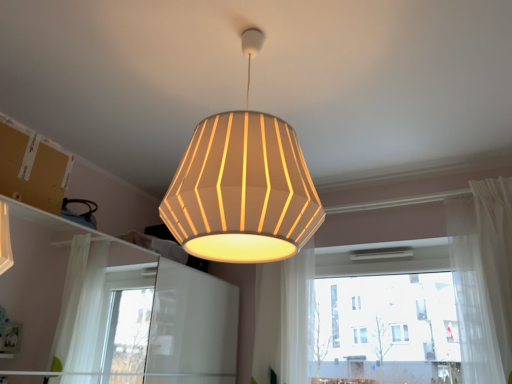
Where is `brown cardboard at upper left`? brown cardboard at upper left is located at coordinates (33, 167).

Locate an element on the screen. The width and height of the screenshot is (512, 384). white sheer curtain at right, which is the first curtain in right-to-left order is located at coordinates (483, 278).

From a real-world perspective, which is physically below, matte white lampshade at center or brown cardboard at upper left?

brown cardboard at upper left.

Which of these two, matte white lampshade at center or brown cardboard at upper left, stands taller?

Standing taller between the two is matte white lampshade at center.

Choose the correct answer: Is matte white lampshade at center inside brown cardboard at upper left or outside it?

matte white lampshade at center cannot be found inside brown cardboard at upper left.

In order to click on lamp above the brown cardboard at upper left (from the image's perspective) in this screenshot , I will do `click(242, 191)`.

Considering the points (263, 174) and (496, 181), which point is behind, point (263, 174) or point (496, 181)?

The point (496, 181) is farther.

Is matte white lampshade at center looking in the opposite direction of white sheer curtain at right, which is the first curtain in right-to-left order?

No, matte white lampshade at center's orientation is not away from white sheer curtain at right, which is the first curtain in right-to-left order.

From the image's perspective, is matte white lampshade at center over white sheer curtain at right, which is the first curtain in right-to-left order?

Correct, matte white lampshade at center appears higher than white sheer curtain at right, which is the first curtain in right-to-left order, in the image.

Does matte white lampshade at center come in front of white sheer curtain at right, which is the first curtain in right-to-left order?

Yes, matte white lampshade at center is closer to the camera.

From a real-world perspective, is brown cardboard at upper left positioned above or below white sheer curtain at center, which is counted as the second curtain, starting from the right?

brown cardboard at upper left is situated higher than white sheer curtain at center, which is counted as the second curtain, starting from the right, in the real world.

Are brown cardboard at upper left and white sheer curtain at center, the 1th curtain when ordered from left to right, far apart?

Absolutely, brown cardboard at upper left is distant from white sheer curtain at center, the 1th curtain when ordered from left to right.

Is point (15, 168) less distant than point (283, 351)?

Yes, point (15, 168) is closer to viewer.

Is white sheer curtain at center, which is counted as the second curtain, starting from the right, completely or partially inside brown cardboard at upper left?

No, white sheer curtain at center, which is counted as the second curtain, starting from the right, is not surrounded by brown cardboard at upper left.

How different are the orientations of white sheer curtain at right, which is the first curtain in right-to-left order, and matte white lampshade at center in degrees?

They differ by 4.72 degrees in their facing directions.

Choose the correct answer: Is white sheer curtain at right, the second curtain viewed from the left, inside matte white lampshade at center or outside it?

white sheer curtain at right, the second curtain viewed from the left, is located beyond the bounds of matte white lampshade at center.

Find the location of a particular element. The image size is (512, 384). the 2nd curtain counting from the right side of the matte white lampshade at center is located at coordinates (483, 278).

Between white sheer curtain at right, the second curtain viewed from the left, and matte white lampshade at center, which one has larger width?

matte white lampshade at center.

Is white glass window at center located outside brown cardboard at upper left?

Absolutely, white glass window at center is external to brown cardboard at upper left.

Between white glass window at center and brown cardboard at upper left, which one has less height?

Standing shorter between the two is brown cardboard at upper left.

From a real-world perspective, is white glass window at center positioned above or below brown cardboard at upper left?

In terms of real-world spatial position, white glass window at center is below brown cardboard at upper left.

Where is `cardboard box above the white glass window at center (from the image's perspective)`? The height and width of the screenshot is (384, 512). cardboard box above the white glass window at center (from the image's perspective) is located at coordinates (33, 167).

Who is bigger, matte white lampshade at center or white sheer curtain at center, the 1th curtain when ordered from left to right?

With larger size is matte white lampshade at center.

What's the angular difference between matte white lampshade at center and white sheer curtain at center, the 1th curtain when ordered from left to right,'s facing directions?

There is a 4.72-degree angle between the facing directions of matte white lampshade at center and white sheer curtain at center, the 1th curtain when ordered from left to right.

From the matte white lampshade at center, count 2nd curtains backward and point to it. Please provide its 2D coordinates.

[(283, 318)]

From a real-world perspective, who is located higher, matte white lampshade at center or white sheer curtain at center, the 1th curtain when ordered from left to right?

matte white lampshade at center.

Looking at this image, is white sheer curtain at center, which is counted as the second curtain, starting from the right, wider or thinner than matte white lampshade at center?

Clearly, white sheer curtain at center, which is counted as the second curtain, starting from the right, has less width compared to matte white lampshade at center.

Do you think white sheer curtain at center, which is counted as the second curtain, starting from the right, is within matte white lampshade at center, or outside of it?

white sheer curtain at center, which is counted as the second curtain, starting from the right, is spatially situated outside matte white lampshade at center.

In the scene shown: Can you confirm if white sheer curtain at center, the 1th curtain when ordered from left to right, is bigger than matte white lampshade at center?

No, white sheer curtain at center, the 1th curtain when ordered from left to right, is not bigger than matte white lampshade at center.

You are a GUI agent. You are given a task and a screenshot of the screen. Output one action in this format:
    pyautogui.click(x=<x>, y=<y>)
    Task: Click on the cardboard box that appears behind the matte white lampshade at center
    
    Given the screenshot: What is the action you would take?
    pyautogui.click(x=33, y=167)

What are the coordinates of `lamp that is on the left side of white sheer curtain at right, the second curtain viewed from the left` in the screenshot? It's located at (242, 191).

Consider the image. Looking at the image, which one is located closer to matte white lampshade at center, white glass window at center or brown cardboard at upper left?

brown cardboard at upper left.

Considering their positions, is matte white lampshade at center positioned further to brown cardboard at upper left than white glass window at center?

white glass window at center is positioned further to the anchor brown cardboard at upper left.

Based on their spatial positions, is matte white lampshade at center or white sheer curtain at center, which is counted as the second curtain, starting from the right, closer to brown cardboard at upper left?

matte white lampshade at center.

Based on their spatial positions, is white sheer curtain at right, the second curtain viewed from the left, or white sheer curtain at center, which is counted as the second curtain, starting from the right, further from matte white lampshade at center?

Based on the image, white sheer curtain at right, the second curtain viewed from the left, appears to be further to matte white lampshade at center.

When comparing their distances from white sheer curtain at center, which is counted as the second curtain, starting from the right, does brown cardboard at upper left or white glass window at center seem closer?

white glass window at center lies closer to white sheer curtain at center, which is counted as the second curtain, starting from the right, than the other object.

Looking at the image, which one is located closer to matte white lampshade at center, white sheer curtain at right, the second curtain viewed from the left, or brown cardboard at upper left?

Based on the image, brown cardboard at upper left appears to be nearer to matte white lampshade at center.

From the image, which object appears to be farther from white glass window at center, matte white lampshade at center or white sheer curtain at right, which is the first curtain in right-to-left order?

The object further to white glass window at center is matte white lampshade at center.

Considering their positions, is brown cardboard at upper left positioned further to matte white lampshade at center than white sheer curtain at right, the second curtain viewed from the left?

white sheer curtain at right, the second curtain viewed from the left, is further to matte white lampshade at center.

The width and height of the screenshot is (512, 384). In order to click on lamp located between brown cardboard at upper left and white sheer curtain at right, the second curtain viewed from the left, in the left-right direction in this screenshot , I will do `click(242, 191)`.

The height and width of the screenshot is (384, 512). Identify the location of bay window between matte white lampshade at center and white sheer curtain at center, which is counted as the second curtain, starting from the right, along the z-axis. (386, 328).

Image resolution: width=512 pixels, height=384 pixels. In order to click on bay window between brown cardboard at upper left and white sheer curtain at right, which is the first curtain in right-to-left order, from left to right in this screenshot , I will do `click(386, 328)`.

The height and width of the screenshot is (384, 512). I want to click on curtain between brown cardboard at upper left and white sheer curtain at right, which is the first curtain in right-to-left order, so click(x=283, y=318).